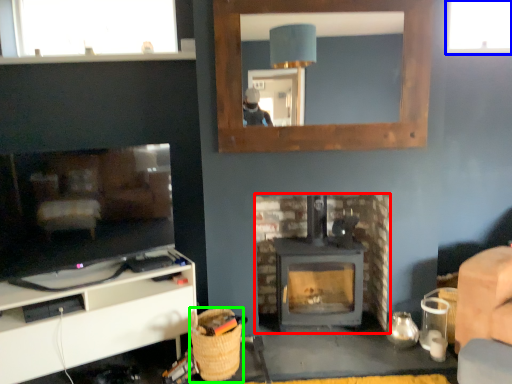
Question: Considering the real-world distances, which object is farthest from fireplace (highlighted by a red box)? window (highlighted by a blue box) or basket (highlighted by a green box)?

Choices:
 (A) window
 (B) basket

Answer: (A)